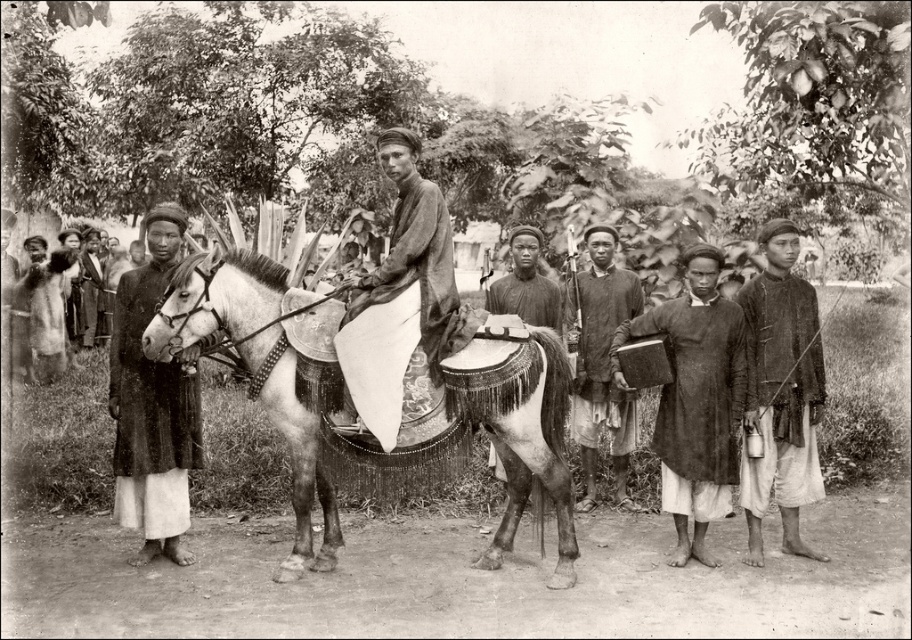
Question: Among these points, which one is farthest from the camera?

Choices:
 (A) (330, 308)
 (B) (684, 452)
 (C) (148, 388)
 (D) (536, 264)

Answer: (D)

Question: Based on their relative distances, which object is nearer to the smooth white cloth at center?

Choices:
 (A) dark brown leather robe at left
 (B) dark brown leather book at center
 (C) smooth wooden box at center

Answer: (A)

Question: Which point is farther to the camera?

Choices:
 (A) (686, 465)
 (B) (801, 467)
 (C) (97, 266)

Answer: (C)

Question: Does dark brown fabric shirt at right appear on the left side of dark brown leather book at center?

Choices:
 (A) yes
 (B) no

Answer: (B)

Question: Is white textured horse at center to the right of dark brown leather book at center from the viewer's perspective?

Choices:
 (A) no
 (B) yes

Answer: (A)

Question: Does white textured horse at center have a larger size compared to dark brown fabric shirt at right?

Choices:
 (A) no
 (B) yes

Answer: (B)